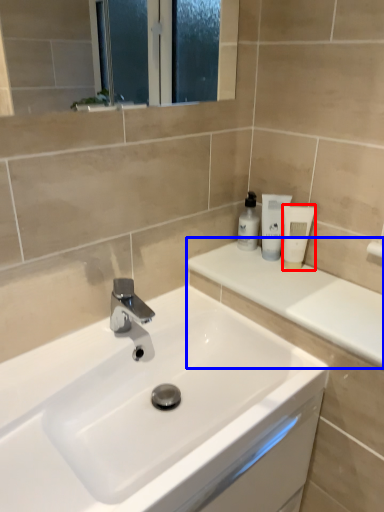
Question: Which of the following is the farthest to the observer, toiletry (highlighted by a red box) or counter top (highlighted by a blue box)?

Choices:
 (A) toiletry
 (B) counter top

Answer: (A)